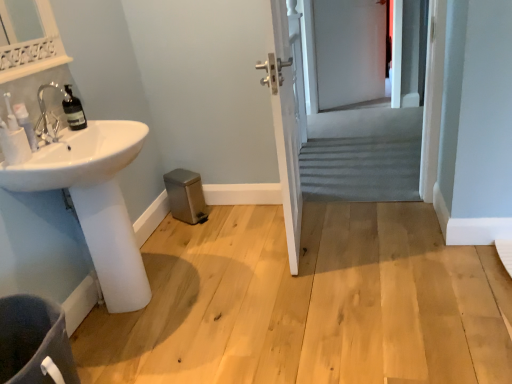
Question: Does dark gray fabric toilet bowl at lower left turn towards white glossy sink at lower left?

Choices:
 (A) no
 (B) yes

Answer: (A)

Question: Is dark gray fabric toilet bowl at lower left thinner than white glossy sink at lower left?

Choices:
 (A) yes
 (B) no

Answer: (B)

Question: Is the position of dark gray fabric toilet bowl at lower left more distant than that of white glossy sink at lower left?

Choices:
 (A) yes
 (B) no

Answer: (B)

Question: Is dark gray fabric toilet bowl at lower left to the right of white glossy sink at lower left from the viewer's perspective?

Choices:
 (A) yes
 (B) no

Answer: (B)

Question: Is dark gray fabric toilet bowl at lower left shorter than white glossy sink at lower left?

Choices:
 (A) yes
 (B) no

Answer: (A)

Question: Can you confirm if dark gray fabric toilet bowl at lower left is bigger than white glossy sink at lower left?

Choices:
 (A) yes
 (B) no

Answer: (B)

Question: From a real-world perspective, is white glossy sink at lower left below gray fabric screen door at center, which is the second screen door from top to bottom?

Choices:
 (A) no
 (B) yes

Answer: (B)

Question: Can you confirm if white glossy sink at lower left is bigger than gray fabric screen door at center, the first screen door when ordered from front to back?

Choices:
 (A) no
 (B) yes

Answer: (B)

Question: Is white glossy sink at lower left oriented towards gray fabric screen door at center, the first screen door when ordered from front to back?

Choices:
 (A) no
 (B) yes

Answer: (A)

Question: Is white glossy sink at lower left to the left of gray fabric screen door at center, acting as the second screen door starting from the back, from the viewer's perspective?

Choices:
 (A) yes
 (B) no

Answer: (A)

Question: From the image's perspective, is white glossy sink at lower left located beneath gray fabric screen door at center, which is the second screen door from top to bottom?

Choices:
 (A) yes
 (B) no

Answer: (A)

Question: From the image's perspective, is white glossy sink at lower left on top of gray fabric screen door at center, acting as the second screen door starting from the back?

Choices:
 (A) yes
 (B) no

Answer: (B)

Question: Considering the relative positions of white glossy sink at lower left and translucent glass bottle at left in the image provided, is white glossy sink at lower left in front of translucent glass bottle at left?

Choices:
 (A) yes
 (B) no

Answer: (A)